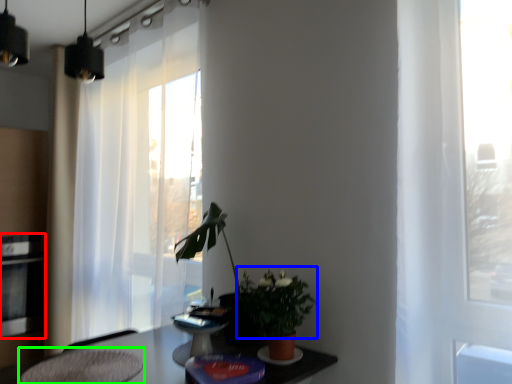
Question: Which is farther away from appliance (highlighted by a red box)? floral arrangement (highlighted by a blue box) or swivel chair (highlighted by a green box)?

Choices:
 (A) floral arrangement
 (B) swivel chair

Answer: (A)